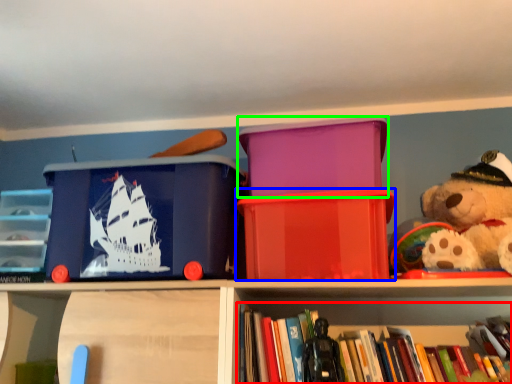
Question: Which object is positioned closest to book (highlighted by a red box)? Select from storage box (highlighted by a blue box) and storage box (highlighted by a green box).

Choices:
 (A) storage box
 (B) storage box

Answer: (A)